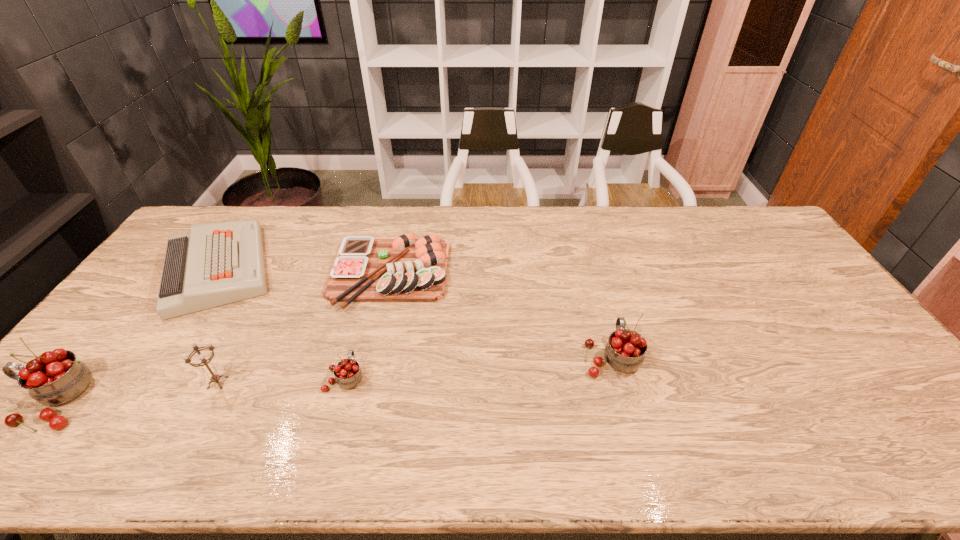
At what (x,y) coordinates should I click in order to perform the action: click on the shortest cherry. Please return your answer as a coordinate pair (x, y). The height and width of the screenshot is (540, 960). Looking at the image, I should click on (348, 374).

The image size is (960, 540). Find the location of `the second cherry from left to right`. the second cherry from left to right is located at coordinates (348, 374).

At what (x,y) coordinates should I click in order to perform the action: click on the rightmost object. Please return your answer as a coordinate pair (x, y). This screenshot has height=540, width=960. Looking at the image, I should click on (625, 350).

Where is `the second tallest cherry`? This screenshot has width=960, height=540. the second tallest cherry is located at coordinates (625, 350).

Identify the location of computer keyboard. This screenshot has width=960, height=540. (214, 264).

Image resolution: width=960 pixels, height=540 pixels. I want to click on platter, so click(405, 269).

Where is `candle holder`? candle holder is located at coordinates click(214, 378).

What are the coordinates of `vacant space located 0.190m on the handle side of the second cherry from left to right` in the screenshot? It's located at (363, 310).

This screenshot has height=540, width=960. In order to click on vacant space positioned on the handle side of the second cherry from left to right in this screenshot , I will do `click(354, 341)`.

The image size is (960, 540). In order to click on free region located 0.200m on the handle side of the second cherry from left to right in this screenshot , I will do `click(364, 307)`.